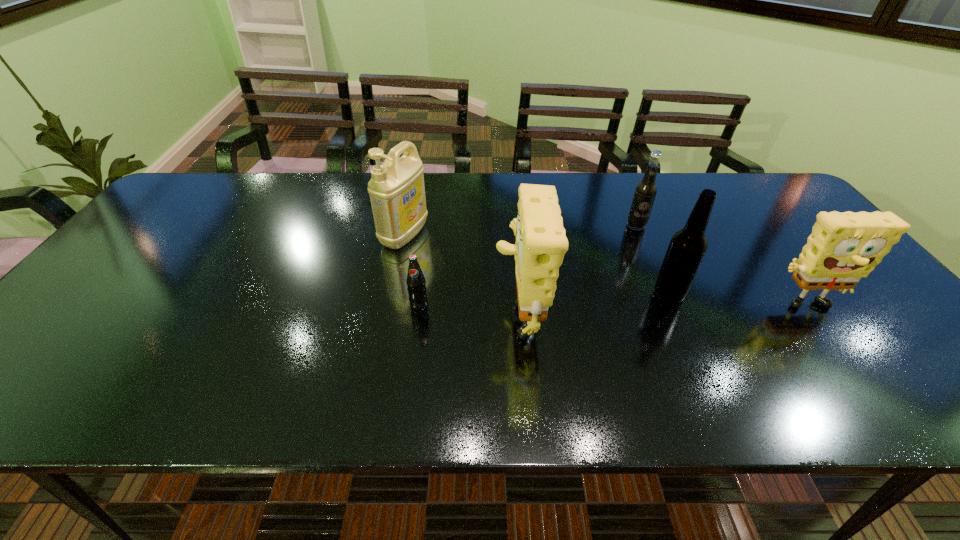
The image size is (960, 540). In order to click on free point that satisfies the following two spatial constraints: 1. on the face of the right sponge; 2. on the face of the third object from left to right in this screenshot , I will do `click(804, 312)`.

Locate an element on the screen. The height and width of the screenshot is (540, 960). free space that satisfies the following two spatial constraints: 1. on the label of the root beer; 2. on the right side of the beer bottle is located at coordinates (665, 294).

The height and width of the screenshot is (540, 960). Find the location of `vacant space that satisfies the following two spatial constraints: 1. on the label of the root beer; 2. on the face of the left sponge`. vacant space that satisfies the following two spatial constraints: 1. on the label of the root beer; 2. on the face of the left sponge is located at coordinates (674, 312).

Where is `vacant space that satisfies the following two spatial constraints: 1. on the label of the root beer; 2. on the face of the third object from left to right`? vacant space that satisfies the following two spatial constraints: 1. on the label of the root beer; 2. on the face of the third object from left to right is located at coordinates (674, 312).

The width and height of the screenshot is (960, 540). What are the coordinates of `free space that satisfies the following two spatial constraints: 1. on the label of the root beer; 2. on the left side of the beer bottle` in the screenshot? It's located at (665, 294).

The height and width of the screenshot is (540, 960). Identify the location of free location that satisfies the following two spatial constraints: 1. on the label of the beer bottle; 2. on the left side of the root beer. (665, 294).